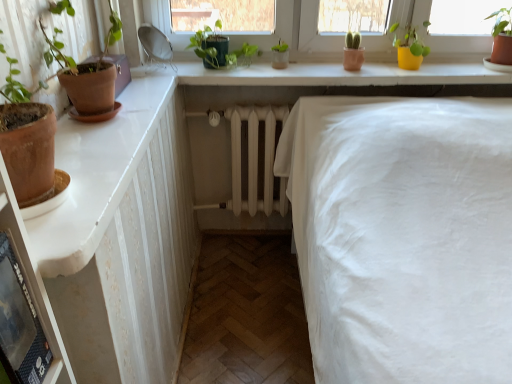
Identify the location of empty space that is to the right of green matte flowerpot at center. This screenshot has width=512, height=384. (320, 69).